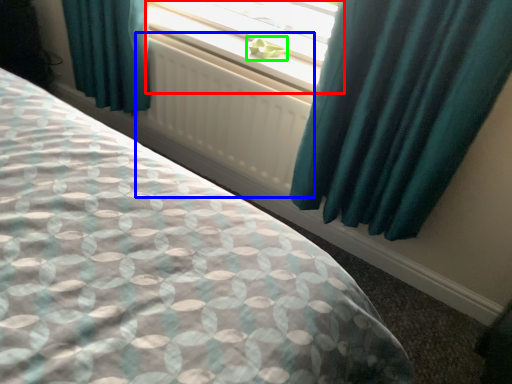
Question: Considering the real-world distances, which object is farthest from window (highlighted by a red box)? radiator (highlighted by a blue box) or plant (highlighted by a green box)?

Choices:
 (A) radiator
 (B) plant

Answer: (A)